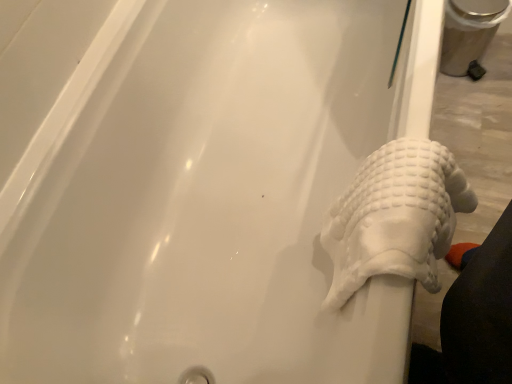
Image resolution: width=512 pixels, height=384 pixels. What do you see at coordinates (395, 217) in the screenshot?
I see `white textured rubber duck at right` at bounding box center [395, 217].

What are the coordinates of `white textured rubber duck at right` in the screenshot? It's located at (x=395, y=217).

Where is `white textured rubber duck at right`? The width and height of the screenshot is (512, 384). white textured rubber duck at right is located at coordinates (395, 217).